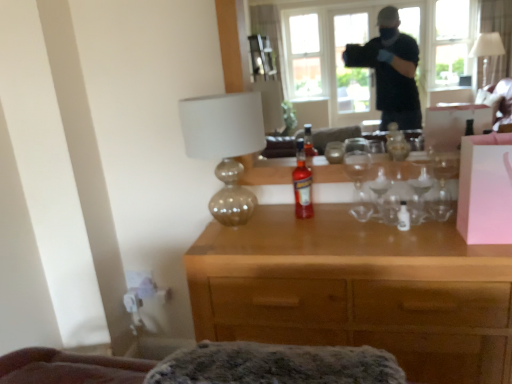
Find the location of a particular element. This screenshot has width=512, height=384. vacant space in front of matte gold lamp at center is located at coordinates (246, 251).